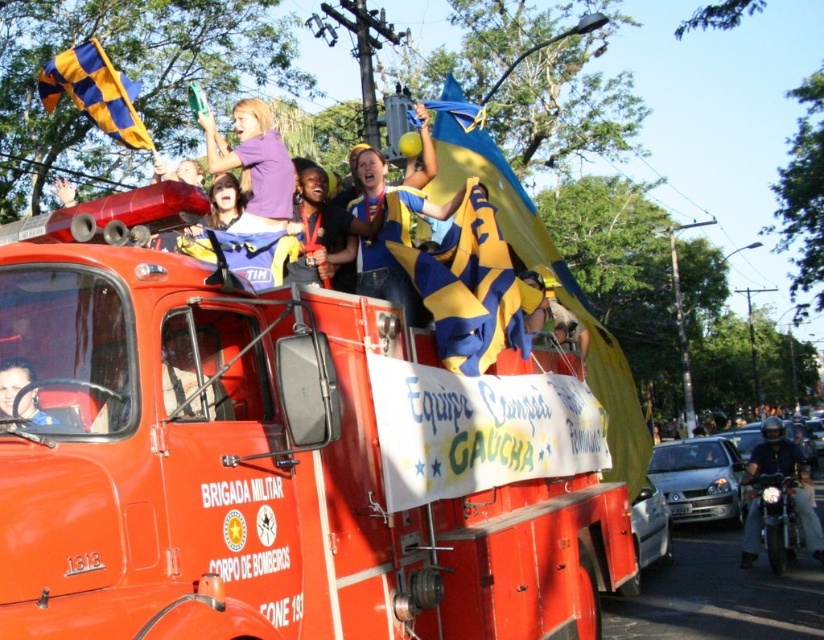
Question: Is blue/yellow jersey at center below purple matte shirt at upper center?

Choices:
 (A) no
 (B) yes

Answer: (B)

Question: Can you confirm if orange matte fire truck at center is bigger than metallic silver helmet at driver's seat?

Choices:
 (A) no
 (B) yes

Answer: (B)

Question: From the image, what is the correct spatial relationship of orange matte fire truck at center in relation to purple matte shirt at upper center?

Choices:
 (A) left
 (B) right

Answer: (B)

Question: Which point is closer to the camera?

Choices:
 (A) (770, 420)
 (B) (570, 312)
 (C) (80, 60)
 (D) (410, 298)

Answer: (D)

Question: Which point is farther to the camera?

Choices:
 (A) metallic silver helmet at driver's seat
 (B) orange matte fire truck at center
 (C) dark blue leather jacket at lower right
 (D) purple matte shirt at upper center

Answer: (C)

Question: Which point is farther to the camera?

Choices:
 (A) blue/yellow checkered flag at upper left
 (B) shiny gold medal at center
 (C) dark blue leather jacket at lower right

Answer: (C)